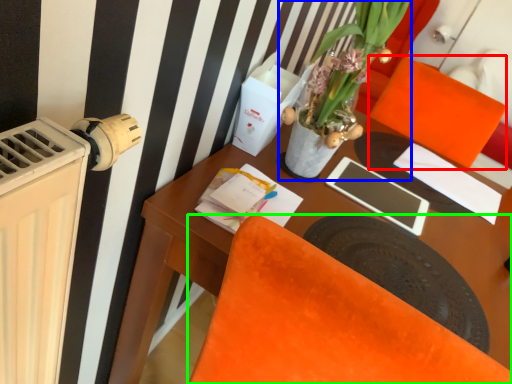
Question: Considering the real-world distances, which object is closest to armchair (highlighted by a red box)? houseplant (highlighted by a blue box) or chair (highlighted by a green box).

Choices:
 (A) houseplant
 (B) chair

Answer: (A)